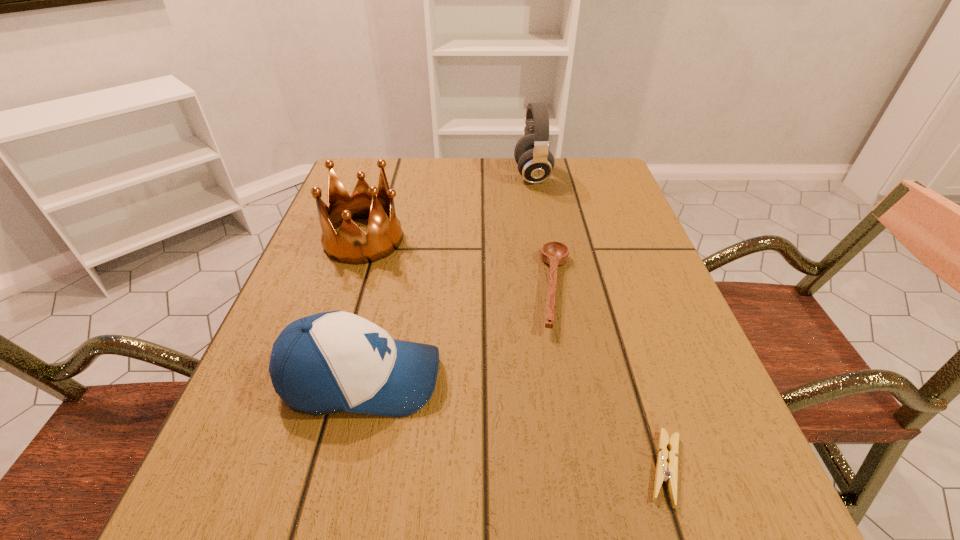
In the image, there is a desktop. In order to click on blank space at the far edge in this screenshot , I will do `click(459, 163)`.

The width and height of the screenshot is (960, 540). Find the location of `free space at the left edge of the desktop`. free space at the left edge of the desktop is located at coordinates (365, 279).

The width and height of the screenshot is (960, 540). Identify the location of vacant area at the right edge. (645, 467).

I want to click on free region at the far left corner, so click(390, 186).

This screenshot has width=960, height=540. Identify the location of blank space at the near left corner. (259, 520).

Locate an element on the screen. free spot at the far right corner of the desktop is located at coordinates (594, 179).

Locate an element on the screen. The width and height of the screenshot is (960, 540). free point between the second nearest object and the headset is located at coordinates (446, 277).

This screenshot has height=540, width=960. I want to click on free space between the wooden spoon and the second nearest object, so click(459, 334).

Find the location of a particular element. The width and height of the screenshot is (960, 540). vacant area that lies between the clothespin and the wooden spoon is located at coordinates (611, 379).

You are a GUI agent. You are given a task and a screenshot of the screen. Output one action in this format:
    pyautogui.click(x=<x>, y=<y>)
    Task: Click on the free space between the nearest object and the baseball cap
    
    Given the screenshot: What is the action you would take?
    pyautogui.click(x=514, y=423)